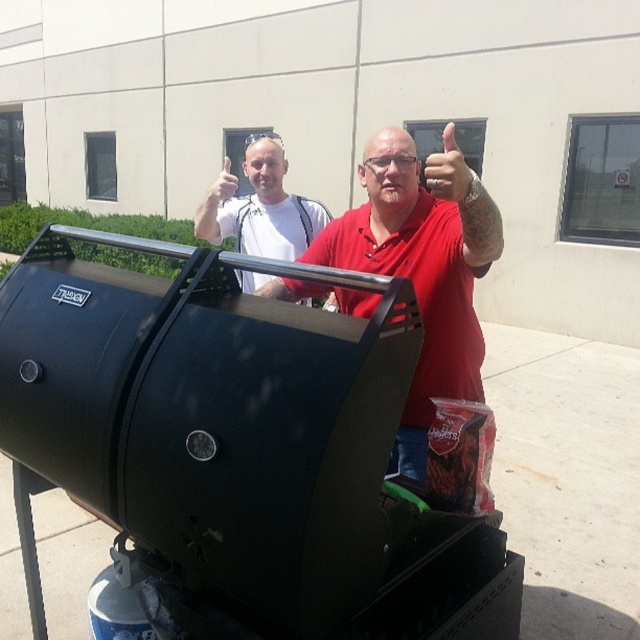
Question: Estimate the real-world distances between objects in this image. Which object is closer to the matte red shirt at center?

Choices:
 (A) matte black hand at upper center
 (B) matte white hand at upper center
 (C) white matte t-shirt at upper left

Answer: (A)

Question: Which point appears farthest from the camera in this image?

Choices:
 (A) (314, 202)
 (B) (307, 285)

Answer: (A)

Question: Does matte black hand at upper center have a smaller size compared to matte white hand at upper center?

Choices:
 (A) yes
 (B) no

Answer: (B)

Question: Which point is farther from the camera taking this photo?

Choices:
 (A) (225, 188)
 (B) (284, 193)
 (C) (442, 134)
 (D) (365, 246)

Answer: (C)

Question: Is matte black hand at upper center positioned behind matte white hand at upper center?

Choices:
 (A) no
 (B) yes

Answer: (A)

Question: Does white matte t-shirt at upper left have a larger size compared to matte black hand at upper center?

Choices:
 (A) no
 (B) yes

Answer: (B)